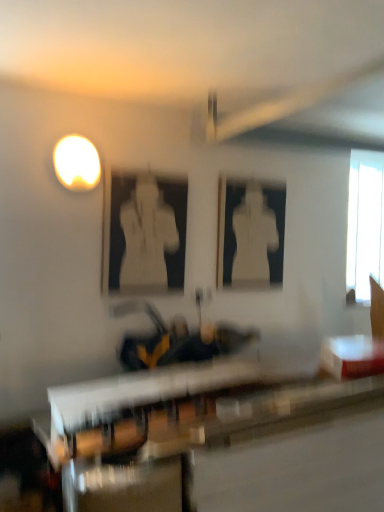
Question: Which direction should I rotate to look at wooden table at center, the first table in the bottom-to-top sequence?

Choices:
 (A) left
 (B) right

Answer: (B)

Question: Can you confirm if white glossy statue at center, which ranks as the first person in right-to-left order, is shorter than transparent glass window at upper right?

Choices:
 (A) yes
 (B) no

Answer: (A)

Question: Is white glossy statue at center, arranged as the first person when viewed from the back, taller than transparent glass window at upper right?

Choices:
 (A) yes
 (B) no

Answer: (B)

Question: Does white glossy statue at center, arranged as the first person when viewed from the back, appear on the left side of transparent glass window at upper right?

Choices:
 (A) no
 (B) yes

Answer: (B)

Question: Is white glossy statue at center, which appears as the second person when viewed from the left, placed right next to transparent glass window at upper right?

Choices:
 (A) yes
 (B) no

Answer: (B)

Question: From a real-world perspective, is white glossy statue at center, arranged as the first person when viewed from the back, under transparent glass window at upper right?

Choices:
 (A) yes
 (B) no

Answer: (A)

Question: Can you confirm if white glossy statue at center, which appears as the second person when viewed from the left, is positioned to the right of transparent glass window at upper right?

Choices:
 (A) yes
 (B) no

Answer: (B)

Question: Is white glossy table at lower right, arranged as the second table when ordered from the bottom, with white glossy statue at center, which is counted as the second person, starting from the right?

Choices:
 (A) yes
 (B) no

Answer: (B)

Question: Is white glossy table at lower right, arranged as the second table when ordered from the bottom, to the left of white glossy statue at center, which is the first person from front to back, from the viewer's perspective?

Choices:
 (A) yes
 (B) no

Answer: (B)

Question: Is the depth of white glossy table at lower right, which is the 1th table in top-to-bottom order, less than that of white glossy statue at center, which is the first person from front to back?

Choices:
 (A) no
 (B) yes

Answer: (B)

Question: Does white glossy table at lower right, arranged as the second table when ordered from the bottom, have a greater width compared to white glossy statue at center, acting as the 1th person starting from the left?

Choices:
 (A) yes
 (B) no

Answer: (A)

Question: Would you say white glossy statue at center, which is the 2th person from back to front, is part of white glossy table at lower right, arranged as the second table when ordered from the bottom,'s contents?

Choices:
 (A) no
 (B) yes

Answer: (A)

Question: Considering the relative positions of white glossy table at lower right, arranged as the second table when ordered from the bottom, and white glossy statue at center, which is the 2th person from back to front, in the image provided, is white glossy table at lower right, arranged as the second table when ordered from the bottom, to the right of white glossy statue at center, which is the 2th person from back to front, from the viewer's perspective?

Choices:
 (A) yes
 (B) no

Answer: (A)

Question: Is white glossy statue at center, acting as the 1th person starting from the left, smaller than matte white light at upper left?

Choices:
 (A) yes
 (B) no

Answer: (B)